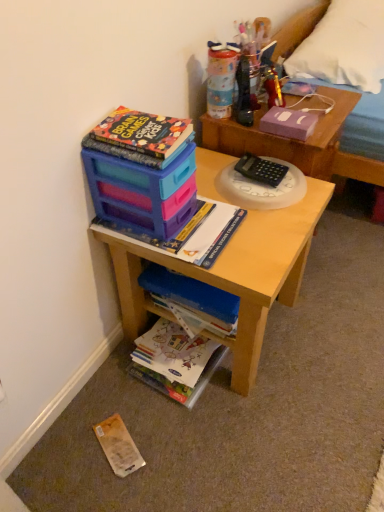
Image resolution: width=384 pixels, height=512 pixels. I want to click on blank area to the left of yellow paper at lower left, arranged as the first paperback book when ordered from the bottom, so click(x=61, y=449).